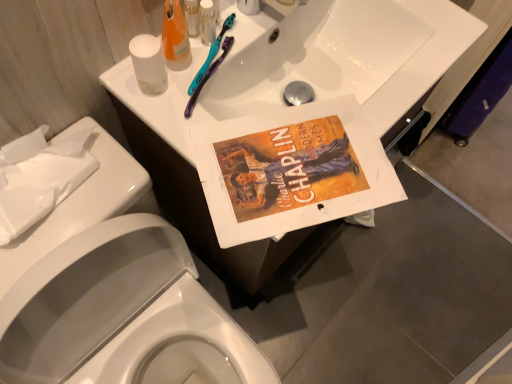
I want to click on free space on the front side of translucent plastic bottle at upper center, which is the second toiletry from right to left, so click(191, 105).